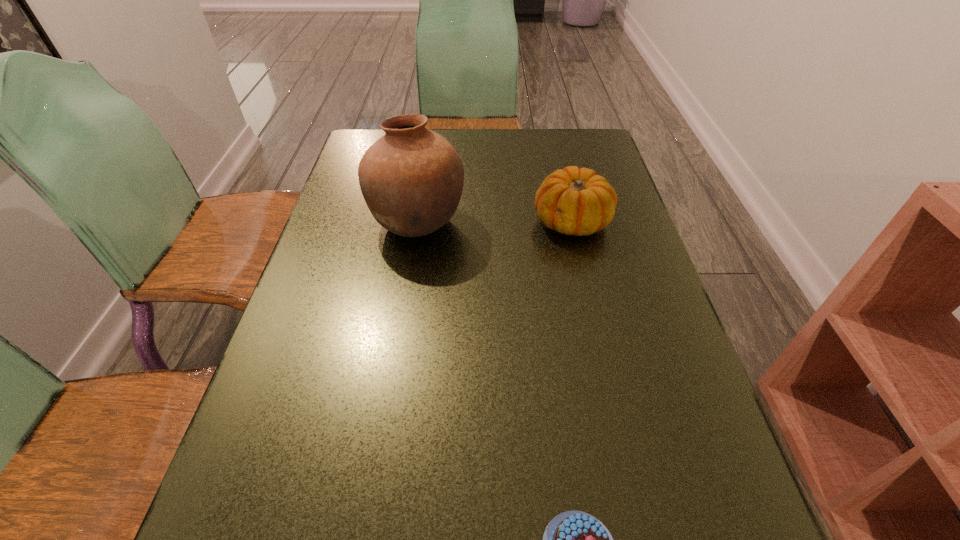
In the image, there is a desktop. Where is `vacant space at the far left corner`? vacant space at the far left corner is located at coordinates (375, 138).

Locate an element on the screen. This screenshot has width=960, height=540. vacant space at the far right corner is located at coordinates (563, 152).

Where is `free space between the pottery and the gourd`? free space between the pottery and the gourd is located at coordinates (494, 221).

Locate an element on the screen. The height and width of the screenshot is (540, 960). free spot between the second shortest object and the leftmost object is located at coordinates (494, 221).

This screenshot has width=960, height=540. I want to click on vacant point located between the pottery and the gourd, so click(x=494, y=221).

Where is `blank region between the second tallest object and the pottery`? The width and height of the screenshot is (960, 540). blank region between the second tallest object and the pottery is located at coordinates (494, 221).

Point out which object is positioned as the nearest to the chocolate cake. Please provide its 2D coordinates. Your answer should be formatted as a tuple, i.e. [(x, y)], where the tuple contains the x and y coordinates of a point satisfying the conditions above.

[(411, 178)]

Identify which object is the closest to the gourd. Please provide its 2D coordinates. Your answer should be formatted as a tuple, i.e. [(x, y)], where the tuple contains the x and y coordinates of a point satisfying the conditions above.

[(411, 178)]

This screenshot has width=960, height=540. Find the location of `vacant space that satisfies the following two spatial constraints: 1. on the back side of the pottery; 2. on the right side of the gourd`. vacant space that satisfies the following two spatial constraints: 1. on the back side of the pottery; 2. on the right side of the gourd is located at coordinates (418, 220).